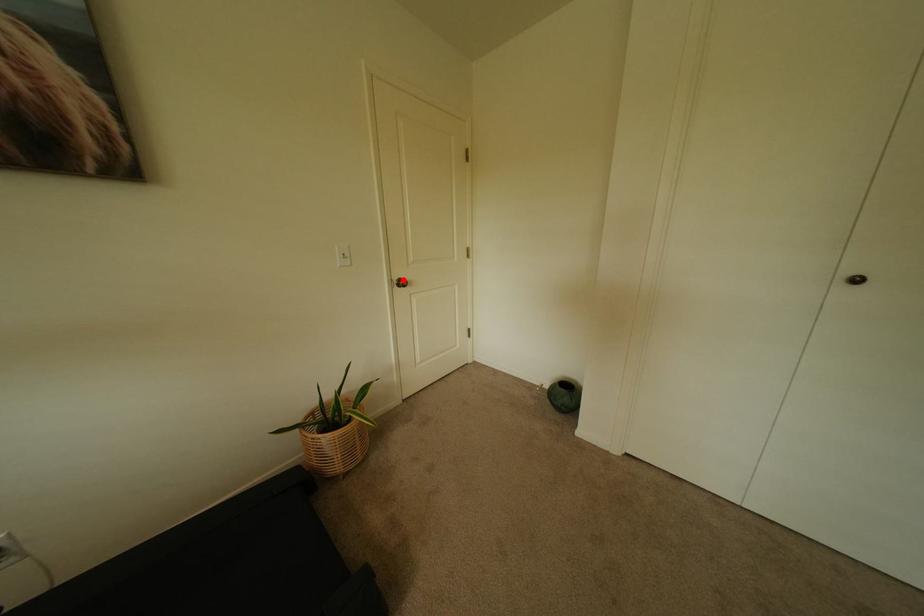
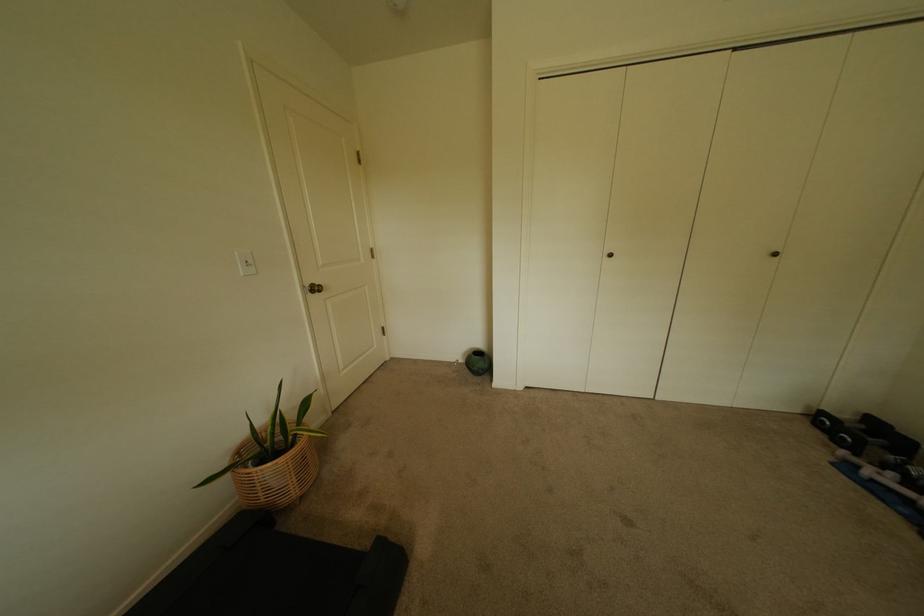
Find the pixel in the second image that matches the highlighted location in the first image.

(315, 286)